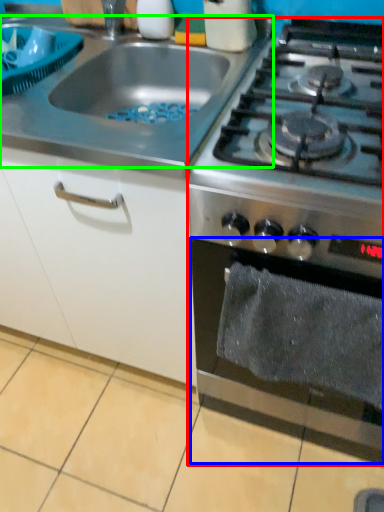
Question: Which is nearer to the gas stove (highlighted by a red box)? oven (highlighted by a blue box) or gas stove (highlighted by a green box).

Choices:
 (A) oven
 (B) gas stove

Answer: (A)